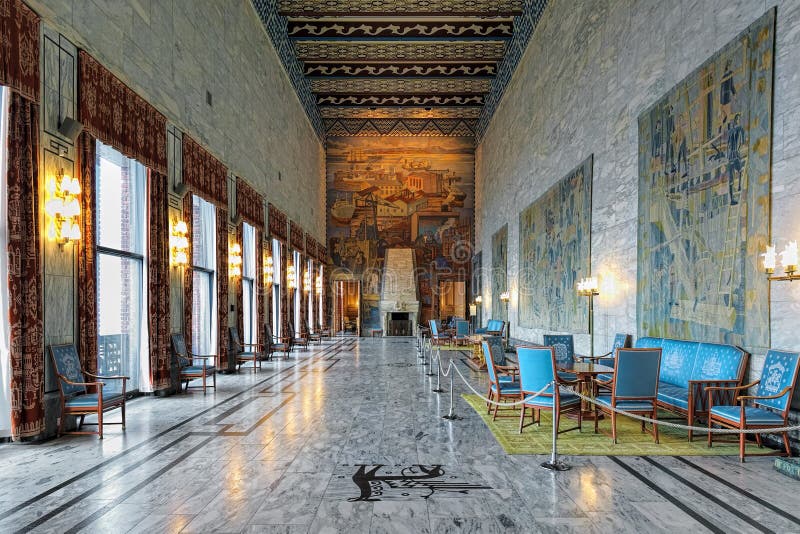
The height and width of the screenshot is (534, 800). In order to click on textured ceiling in this screenshot , I will do `click(366, 108)`, `click(354, 34)`.